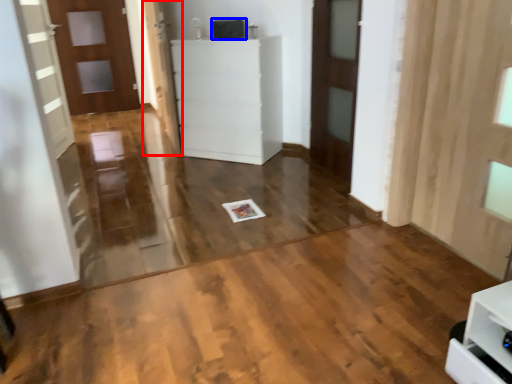
Question: Which point is further to the camera, door (highlighted by a red box) or appliance (highlighted by a blue box)?

Choices:
 (A) door
 (B) appliance

Answer: (B)